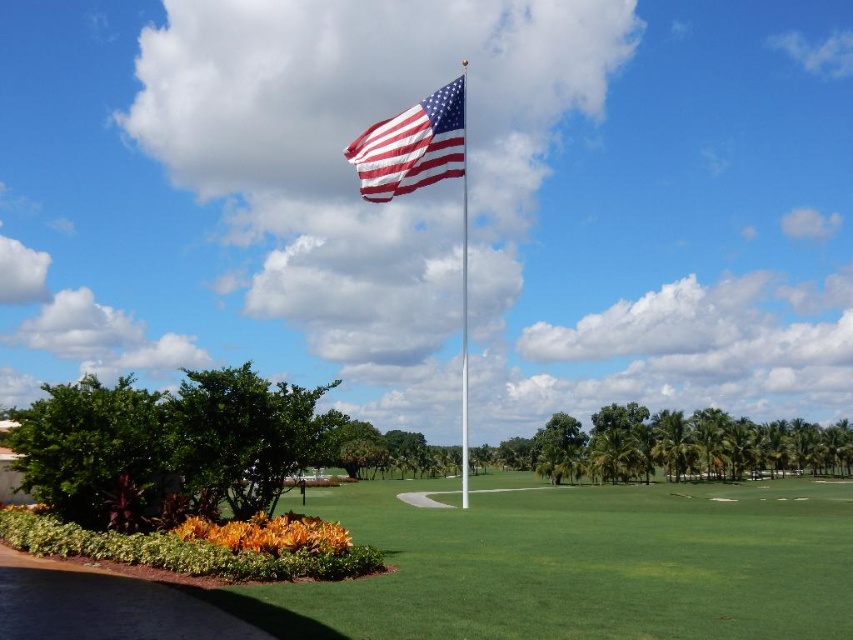
Looking at this image, you are a drone operator trying to capture a photo of the flagpole in the image. The camera is currently positioned at point A. The green grass at center is located at point B. To ensure the flagpole is centered in the photo, should you move the camera closer to point B or away from it?

The green grass at center is located at point B. Since the flagpole is in the center of the frame, moving the camera closer to point B would bring the flagpole into focus and center it in the photo.